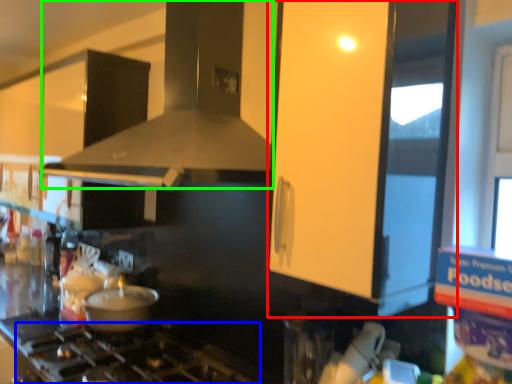
Question: Based on their relative distances, which object is nearer to glass door (highlighted by a red box)? Choose from gas stove (highlighted by a blue box) and vent (highlighted by a green box).

Choices:
 (A) gas stove
 (B) vent

Answer: (B)